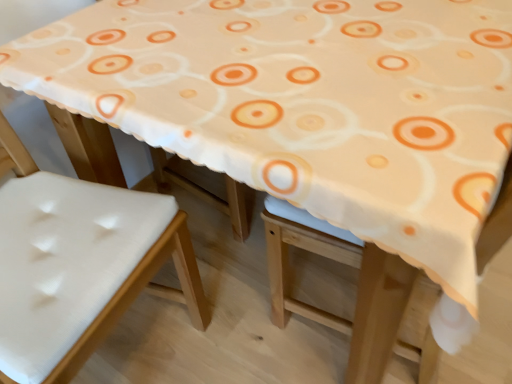
This screenshot has height=384, width=512. I want to click on white fabric chair at lower left, so (78, 264).

The image size is (512, 384). Describe the element at coordinates (78, 264) in the screenshot. I see `white fabric chair at lower left` at that location.

Where is `white fabric chair at lower left`? The width and height of the screenshot is (512, 384). white fabric chair at lower left is located at coordinates pyautogui.click(x=78, y=264).